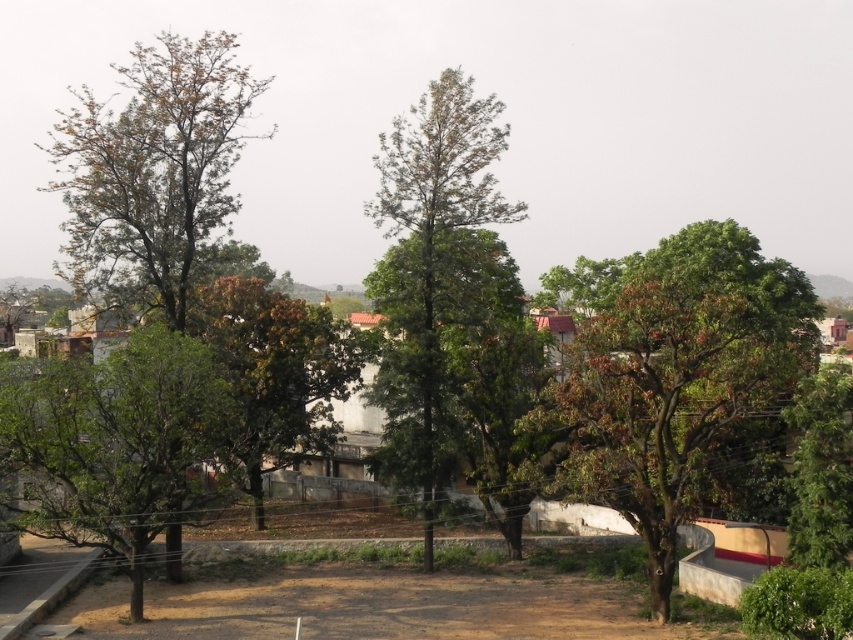
Question: From the image, what is the correct spatial relationship of green leafy tree at right in relation to brown textured tree at left?

Choices:
 (A) above
 (B) below

Answer: (B)

Question: Which is farther from the brown textured tree at center?

Choices:
 (A) green leafy tree at left
 (B) brown textured tree at left

Answer: (B)

Question: Which point is farther to the camera?

Choices:
 (A) (479, 310)
 (B) (308, 378)
 (C) (172, 116)

Answer: (B)

Question: Is green leafy tree at right positioned in front of green leafy tree at center?

Choices:
 (A) yes
 (B) no

Answer: (A)

Question: Which point is farther from the camera taking this photo?

Choices:
 (A) (125, 301)
 (B) (440, 342)

Answer: (B)

Question: Is green leafy tree at center bigger than green leafy tree at left?

Choices:
 (A) no
 (B) yes

Answer: (B)